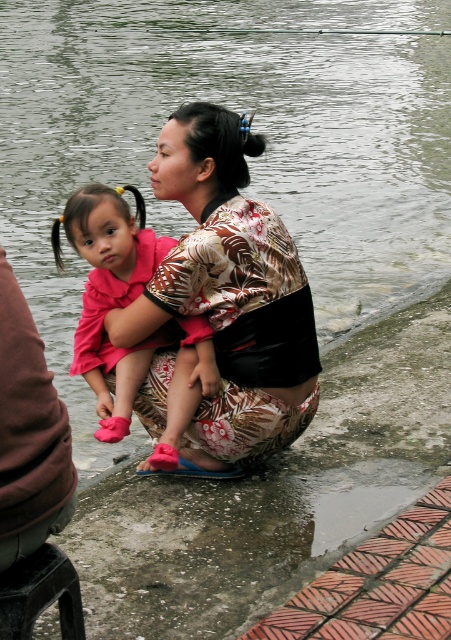
Question: Does printed fabric kimono at center appear on the right side of wooden stool at lower left?

Choices:
 (A) yes
 (B) no

Answer: (A)

Question: Which of the following is the closest to the observer?

Choices:
 (A) wooden stool at lower left
 (B) printed fabric kimono at center
 (C) pink fabric dress at center
 (D) brown fabric squat at lower left

Answer: (D)

Question: Does printed fabric kimono at center appear on the left side of brown fabric squat at lower left?

Choices:
 (A) no
 (B) yes

Answer: (A)

Question: Is brown fabric squat at lower left smaller than wooden stool at lower left?

Choices:
 (A) no
 (B) yes

Answer: (A)

Question: Which object is positioned closest to the pink fabric dress at center?

Choices:
 (A) printed fabric kimono at center
 (B) wooden stool at lower left
 (C) brown fabric squat at lower left

Answer: (A)

Question: Which object is farther from the camera taking this photo?

Choices:
 (A) wooden stool at lower left
 (B) brown fabric squat at lower left
 (C) pink fabric dress at center
 (D) printed fabric kimono at center

Answer: (C)